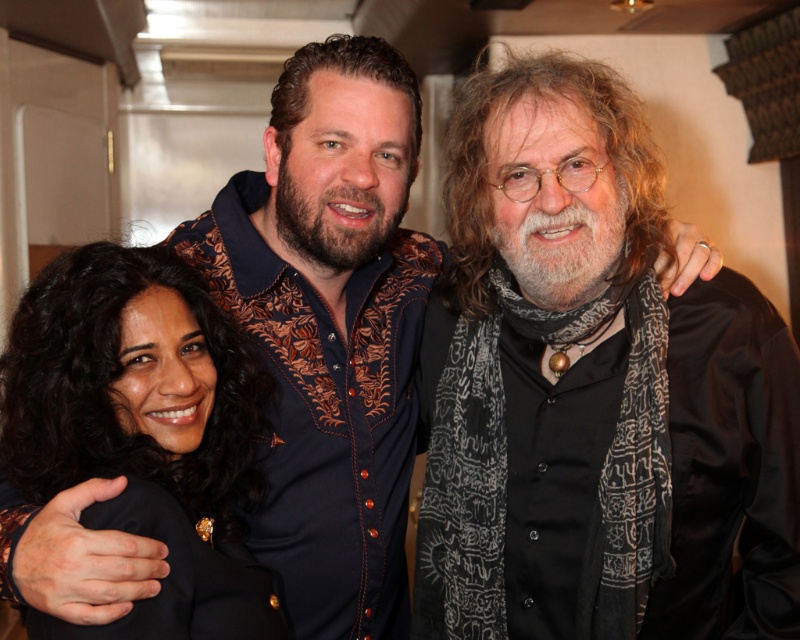
Question: Is black satin shirt at center to the right of black satin jacket at lower left from the viewer's perspective?

Choices:
 (A) no
 (B) yes

Answer: (B)

Question: Considering the relative positions of black satin shirt at center and black satin jacket at lower left in the image provided, where is black satin shirt at center located with respect to black satin jacket at lower left?

Choices:
 (A) left
 (B) right

Answer: (B)

Question: Does black satin shirt at center have a larger size compared to black satin jacket at lower left?

Choices:
 (A) yes
 (B) no

Answer: (A)

Question: Which object is farther from the camera taking this photo?

Choices:
 (A) black satin jacket at lower left
 (B) black satin shirt at center

Answer: (B)

Question: Among these objects, which one is nearest to the camera?

Choices:
 (A) black satin shirt at center
 (B) black satin jacket at lower left

Answer: (B)